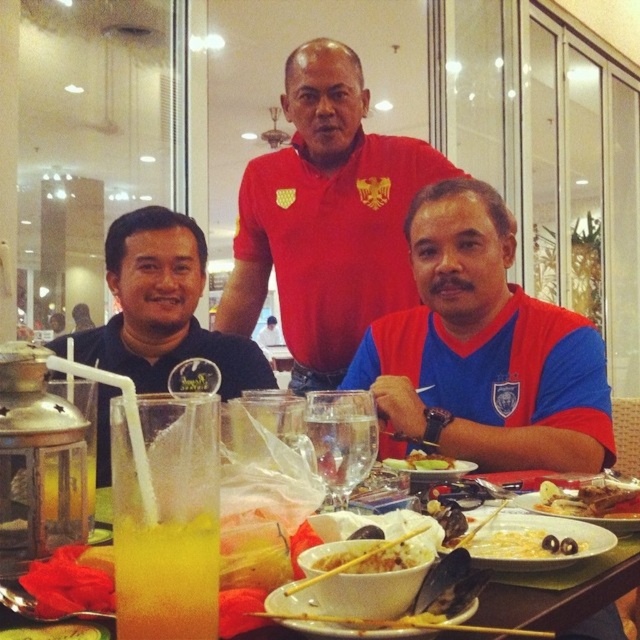
You are a server at the table. You need to place a new dish between the two points marked as point [156,225] and point 0.456, 0.789. Can you fit it there?

The two points are 4.98 feet apart, so the dish can be placed between them as there is sufficient space.

You are a server at the restaurant and need to determine if the translucent glass beverage at lower left can fit into a storage rack designed for glasses wider than the clear glass water at center. Can it fit?

The translucent glass beverage at lower left might be wider than clear glass water at center, so it could potentially fit into the storage rack designed for wider glasses.

You are a waiter at this table and need to deliver a dessert plate to the customer. The dessert plate is currently placed behind the black matte shirt at left and the yellowish matte rice at center. Which object should you move first to access the dessert plate?

You should move the black matte shirt at left first because it is closer to the viewer than the yellowish matte rice at center, so it is blocking the path to the dessert plate behind them.